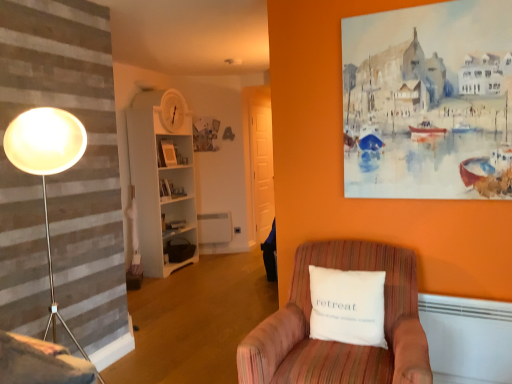
Question: Does striped fabric armchair at lower right lie behind velvet pink swivel chair at lower left?

Choices:
 (A) no
 (B) yes

Answer: (A)

Question: From the image's perspective, would you say striped fabric armchair at lower right is positioned over velvet pink swivel chair at lower left?

Choices:
 (A) no
 (B) yes

Answer: (A)

Question: Are striped fabric armchair at lower right and velvet pink swivel chair at lower left located far from each other?

Choices:
 (A) no
 (B) yes

Answer: (A)

Question: From a real-world perspective, is striped fabric armchair at lower right positioned over velvet pink swivel chair at lower left based on gravity?

Choices:
 (A) no
 (B) yes

Answer: (A)

Question: Is striped fabric armchair at lower right next to velvet pink swivel chair at lower left and touching it?

Choices:
 (A) no
 (B) yes

Answer: (A)

Question: Do you think white wood bookshelf at center is within striped fabric armchair at lower right, or outside of it?

Choices:
 (A) outside
 (B) inside

Answer: (A)

Question: Based on their sizes in the image, would you say white wood bookshelf at center is bigger or smaller than striped fabric armchair at lower right?

Choices:
 (A) small
 (B) big

Answer: (B)

Question: In the image, is white wood bookshelf at center on the left side or the right side of striped fabric armchair at lower right?

Choices:
 (A) left
 (B) right

Answer: (A)

Question: From the image's perspective, relative to striped fabric armchair at lower right, is white wood bookshelf at center above or below?

Choices:
 (A) below
 (B) above

Answer: (B)

Question: From a real-world perspective, is velvet pink swivel chair at lower left above or below striped fabric armchair at lower right?

Choices:
 (A) below
 (B) above

Answer: (B)

Question: In terms of size, does velvet pink swivel chair at lower left appear bigger or smaller than striped fabric armchair at lower right?

Choices:
 (A) small
 (B) big

Answer: (A)

Question: From the image's perspective, is velvet pink swivel chair at lower left located above or below striped fabric armchair at lower right?

Choices:
 (A) below
 (B) above

Answer: (B)

Question: Is point (5, 365) positioned closer to the camera than point (239, 350)?

Choices:
 (A) closer
 (B) farther

Answer: (A)

Question: In terms of size, does striped fabric armchair at lower right appear bigger or smaller than white wood bookshelf at center?

Choices:
 (A) small
 (B) big

Answer: (A)

Question: Is striped fabric armchair at lower right in front of or behind white wood bookshelf at center in the image?

Choices:
 (A) behind
 (B) front

Answer: (B)